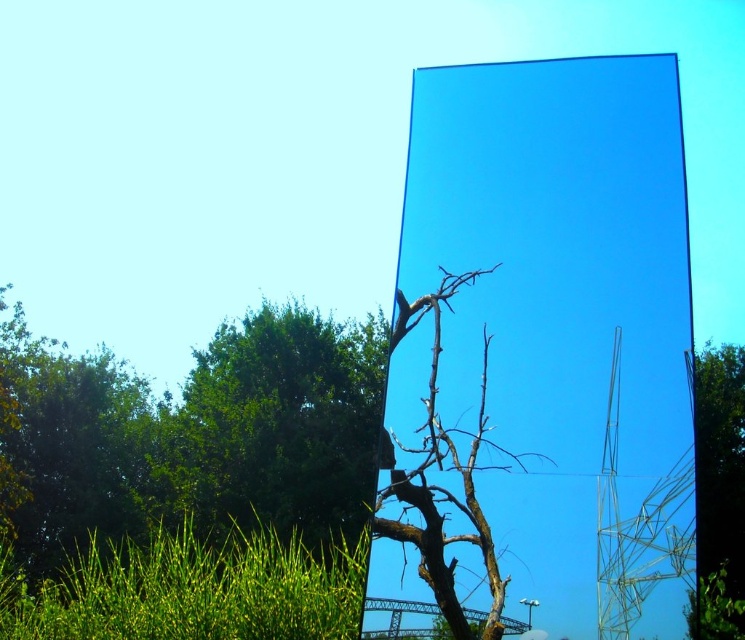
You are standing in front of the mirror and want to see the green leafy tree at lower left in your reflection. Based on the mirror placement, where should you look on the mirror to see its reflection?

The green leafy tree at lower left is located at point [273,426], so you should look at that coordinate on the mirror to see its reflection.

You are standing in front of the mirror and want to know which object is shorter between the green grass at lower left and the green leafy tree at right. Can you determine this based on their positions?

The green grass at lower left has a lesser height compared to green leafy tree at right, so the green grass at lower left is shorter.

You are standing in front of the mirror and want to determine the position of the green leafy tree at lower left and the green grass at lower left relative to each other. Which one is higher up?

The green leafy tree at lower left is above green grass at lower left.